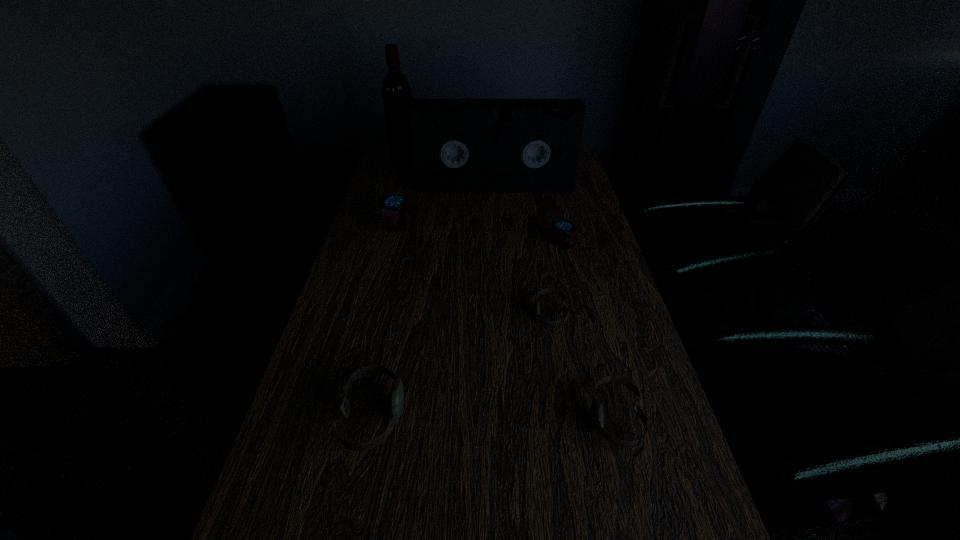
Select which watch is the fourth closest to the smallest beige watch. Please provide its 2D coordinates. Your answer should be formatted as a tuple, i.e. [(x, y)], where the tuple contains the x and y coordinates of a point satisfying the conditions above.

[(394, 208)]

I want to click on watch that is the third closest to the rightmost beige watch, so click(564, 228).

The height and width of the screenshot is (540, 960). I want to click on beige watch that is the second closest to the third nearest object, so click(x=398, y=391).

The height and width of the screenshot is (540, 960). I want to click on the closest beige watch relative to the smallest beige watch, so click(596, 406).

At what (x,y) coordinates should I click in order to perform the action: click on free location that satisfies the following two spatial constraints: 1. on the side of the sixth shortest object with visible spindles; 2. on the face of the leftmost beige watch. Please return your answer as a coordinate pair (x, y). This screenshot has width=960, height=540. Looking at the image, I should click on (506, 415).

Identify the location of free location that satisfies the following two spatial constraints: 1. on the front side of the right red watch; 2. on the left side of the left red watch. (392, 245).